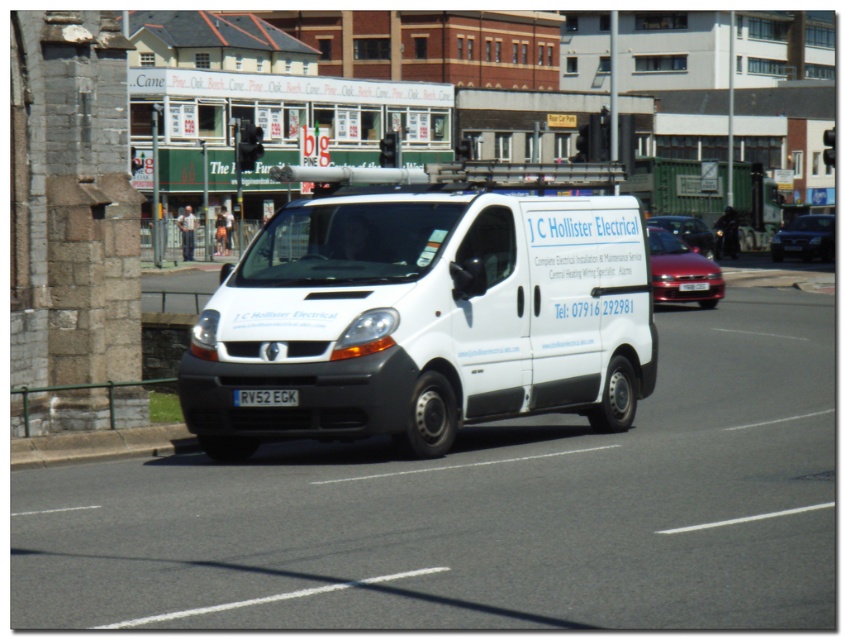
You are a delivery driver who needs to park your vehicle between the shiny red car at center and the white plastic license plate at center. Which object should you position your vehicle closer to in order to ensure it doesn not block the license plate?

The shiny red car at center is taller than the white plastic license plate at center, so you should position your vehicle closer to the shiny red car at center to avoid blocking the license plate.

You are a pedestrian standing on the sidewalk and see the shiny red car at center and the white plastic license plate at center. Which object is higher from the ground?

The shiny red car at center is higher from the ground than the white plastic license plate at center.

You are a delivery driver in a white van and you need to park your van behind the shiny red sedan at center so that the white rectangular at center is completely hidden from view. Is this possible?

The shiny red sedan at center is taller than white rectangular at center. Since the sedan is taller, parking the van behind it would block the white rectangular at center from view.